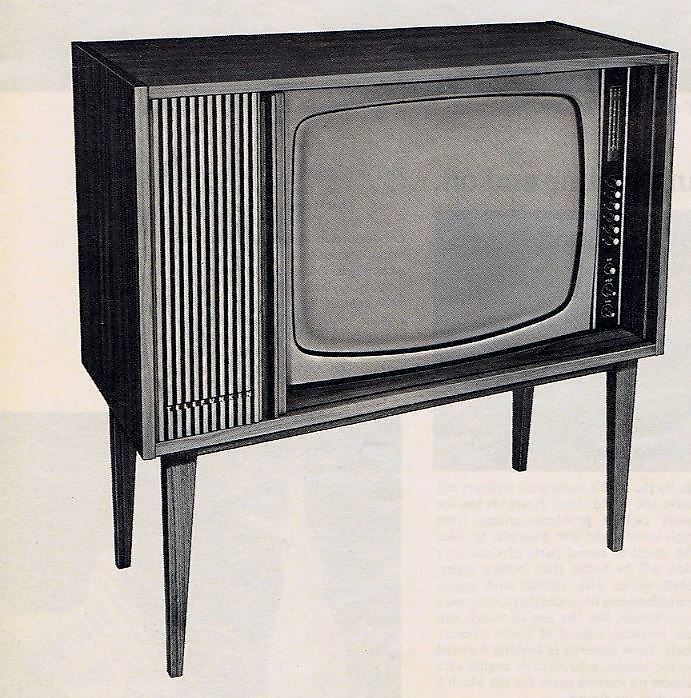
Image resolution: width=691 pixels, height=698 pixels. Identify the location of magazine page. (442, 641).